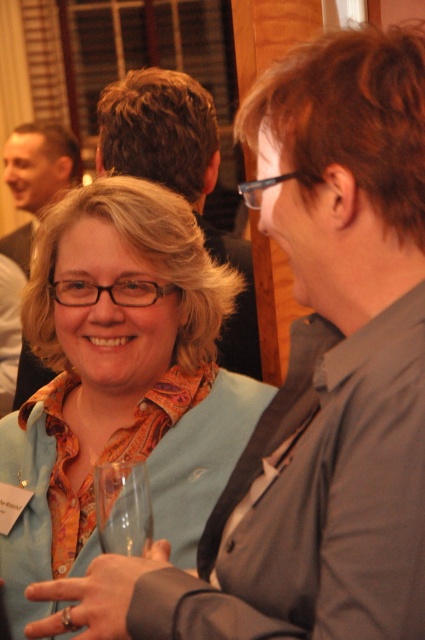
Question: Does matte orange shirt at center appear over matte black shirt at upper left?

Choices:
 (A) yes
 (B) no

Answer: (B)

Question: Estimate the real-world distances between objects in this image. Which object is closer to the matte black shirt at upper left?

Choices:
 (A) transparent glass at lower left
 (B) matte orange shirt at center
 (C) brown hair at center

Answer: (C)

Question: Does brown hair at center appear on the left side of transparent glass at lower left?

Choices:
 (A) no
 (B) yes

Answer: (A)

Question: Can you confirm if matte orange shirt at center is thinner than transparent glass at lower left?

Choices:
 (A) yes
 (B) no

Answer: (B)

Question: Among these points, which one is farthest from the camera?

Choices:
 (A) (27, 344)
 (B) (232, 436)
 (C) (93, 481)

Answer: (A)

Question: Which point appears closest to the camera in this image?

Choices:
 (A) (67, 157)
 (B) (178, 308)
 (C) (127, 483)

Answer: (C)